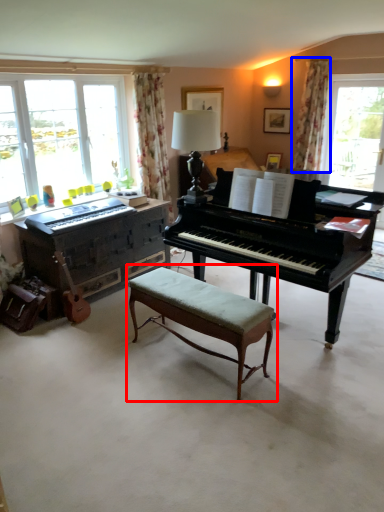
Question: Which object is closer to the camera taking this photo, table (highlighted by a red box) or curtain (highlighted by a blue box)?

Choices:
 (A) table
 (B) curtain

Answer: (A)